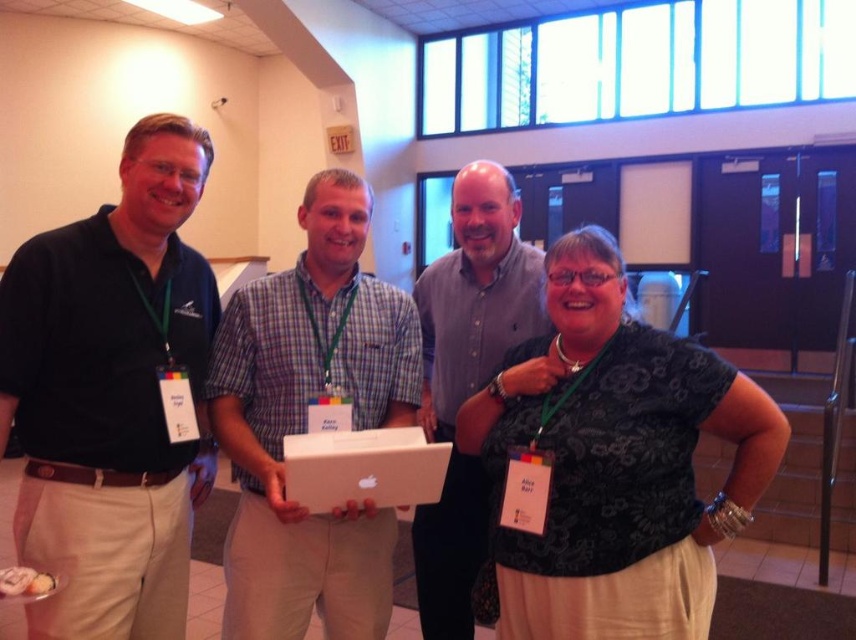
Is black floral blouse at center above matte gray shirt at center?

Correct, black floral blouse at center is located above matte gray shirt at center.

Is black floral blouse at center positioned before matte gray shirt at center?

Yes, it is.

Who is more forward, (563, 481) or (506, 266)?

Point (563, 481) is more forward.

Find the location of `black floral blouse at center`. black floral blouse at center is located at coordinates click(x=615, y=461).

Can you confirm if plaid cotton shirt at center is bigger than white cardboard box at center?

Indeed, plaid cotton shirt at center has a larger size compared to white cardboard box at center.

Is point (331, 234) closer to camera compared to point (299, 499)?

No.

The image size is (856, 640). Identify the location of plaid cotton shirt at center. (307, 422).

Does matte black polo shirt at left appear on the right side of white cardboard box at center?

No, matte black polo shirt at left is not to the right of white cardboard box at center.

Describe the element at coordinates (110, 394) in the screenshot. I see `matte black polo shirt at left` at that location.

The height and width of the screenshot is (640, 856). Find the location of `matte black polo shirt at left`. matte black polo shirt at left is located at coordinates [110, 394].